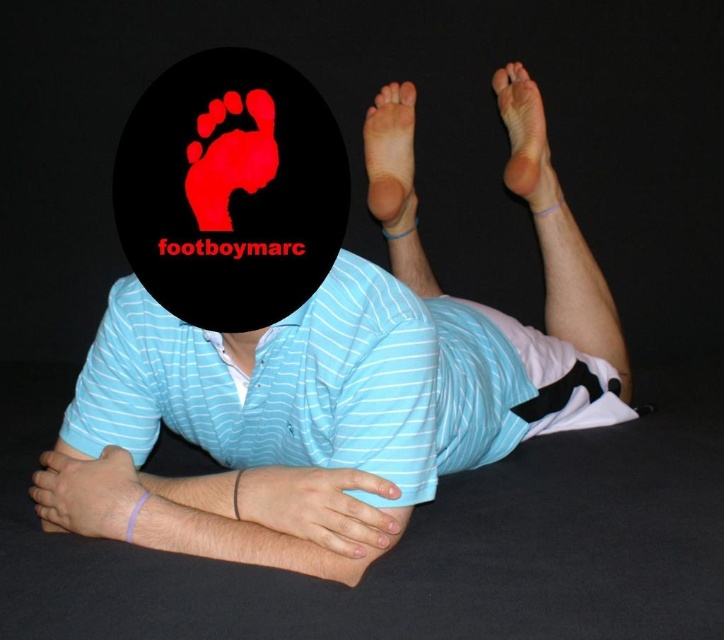
What is the position of the pale skin hand at lower left in the image?

The pale skin hand at lower left is located at point (x=85, y=492).

You are a physical therapist observing a patient in a rehabilitation session. The patient is in a position where their pale skin hand at lower left and smooth skin foot at upper right are visible. Based on their current positioning, which body part is higher up from the ground?

The smooth skin foot at upper right is higher up from the ground than the pale skin hand at lower left because the pale skin hand at lower left is below smooth skin foot at upper right.